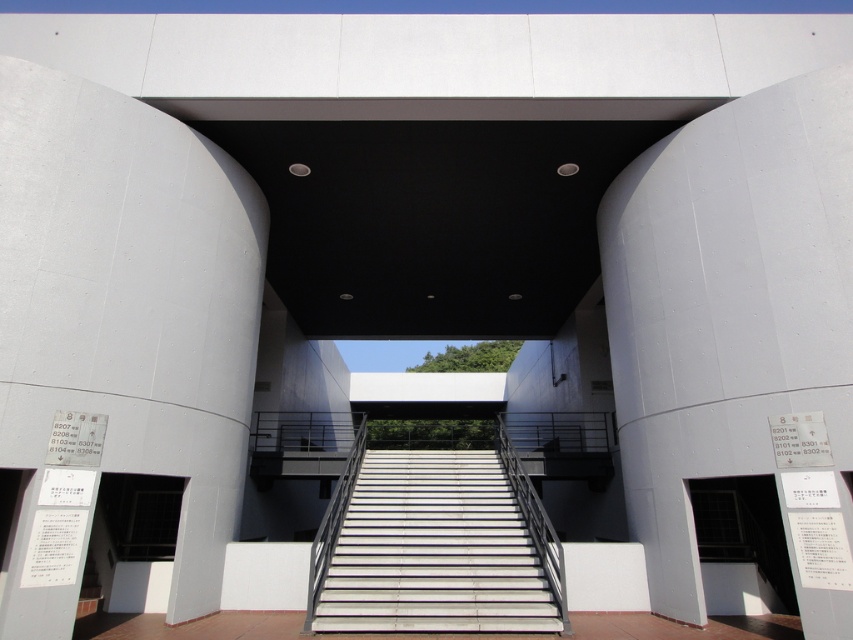
Looking at this image, you are a delivery person carrying a package that requires a clear path of at least 3 meters between the white concrete stairs at center and the white matte door at lower right. Based on the scene description, is the distance sufficient for your delivery route?

The white concrete stairs at center and white matte door at lower right are 3.31 meters apart, which is more than the required 3 meters, so the distance is sufficient for the delivery route.

You are standing at the entrance of the modern building and want to take a photo of the smooth concrete pillar at left. If your camera has a maximum focus range of 15 feet, will it be able to focus on the pillar?

The smooth concrete pillar at left and camera are 17.22 feet apart from each other, which exceeds the camera maximum focus range of 15 feet. Therefore, the camera cannot focus on the pillar.

You are standing at the base of the white concrete stairs at center, and you need to take a photo of the entrance. If your camera can capture objects up to 10 meters away, will you be able to take a clear photo of the entrance from your current position?

The white concrete stairs at center and camera are 9.51 meters apart from each other. Since the camera can capture up to 10 meters, you can take a clear photo of the entrance from your current position.